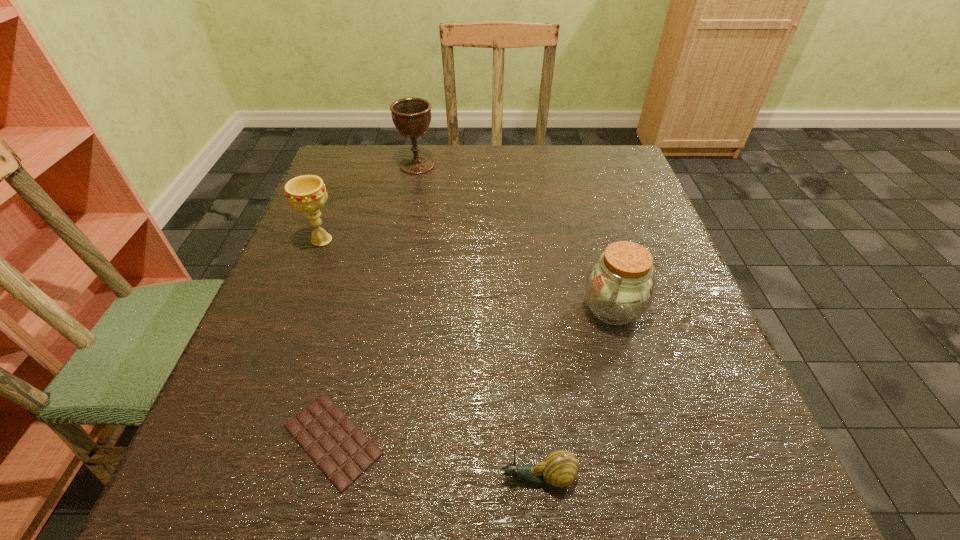
The height and width of the screenshot is (540, 960). I want to click on vacant space in between the farthest object and the chocolate bar, so click(x=374, y=302).

Find the location of a particular element. vacant region between the left chalice and the farther chalice is located at coordinates (370, 202).

Find the location of a particular element. This screenshot has width=960, height=540. unoccupied area between the left chalice and the farthest object is located at coordinates (370, 202).

Locate an element on the screen. This screenshot has height=540, width=960. free space between the leftmost object and the second shortest object is located at coordinates (429, 359).

Image resolution: width=960 pixels, height=540 pixels. I want to click on free point between the second object from right to left and the nearer chalice, so click(429, 359).

Find the location of a particular element. vacant region between the escargot and the left chalice is located at coordinates (429, 359).

Where is `free space between the second object from right to left and the second farthest object`? The image size is (960, 540). free space between the second object from right to left and the second farthest object is located at coordinates (429, 359).

Where is `unoccupied area between the chocolate bar and the fourth nearest object`? unoccupied area between the chocolate bar and the fourth nearest object is located at coordinates (327, 340).

This screenshot has width=960, height=540. What are the coordinates of `free space between the shortest object and the rightmost object` in the screenshot? It's located at (472, 374).

Identify which object is the second nearest to the jar. Please provide its 2D coordinates. Your answer should be formatted as a tuple, i.e. [(x, y)], where the tuple contains the x and y coordinates of a point satisfying the conditions above.

[(340, 449)]